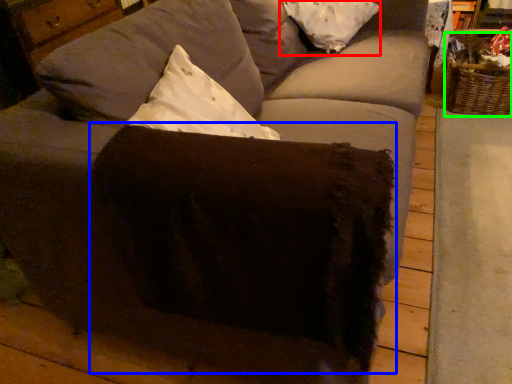
Question: Which is nearer to the pillow (highlighted by a red box)? swivel chair (highlighted by a blue box) or basket (highlighted by a green box).

Choices:
 (A) swivel chair
 (B) basket

Answer: (B)